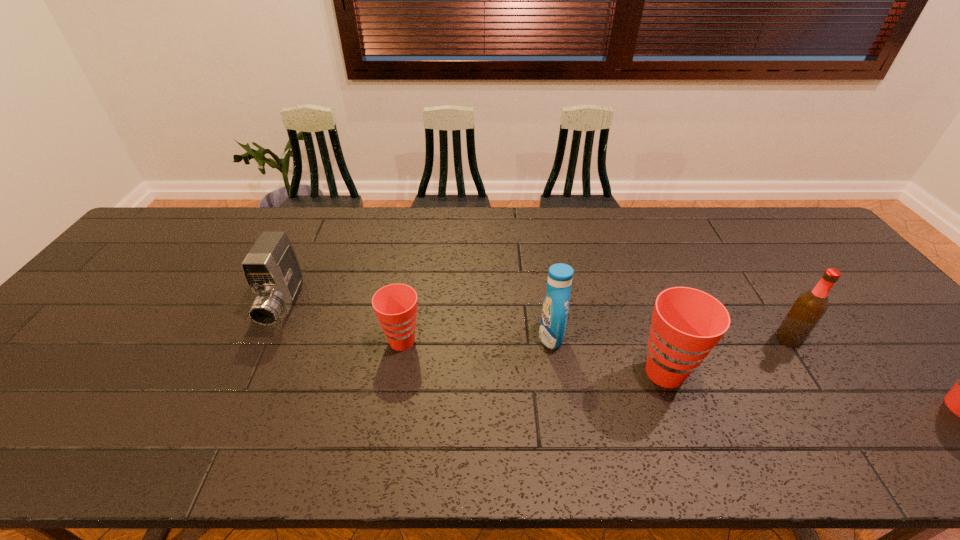
I want to click on vacant region that satisfies the following two spatial constraints: 1. on the front-facing side of the third object from right to left; 2. on the left side of the rightmost object, so click(x=551, y=339).

Find the location of a particular element. free space that satisfies the following two spatial constraints: 1. at the front of the camcorder, highlighting the lens; 2. on the right side of the taller cup is located at coordinates (253, 373).